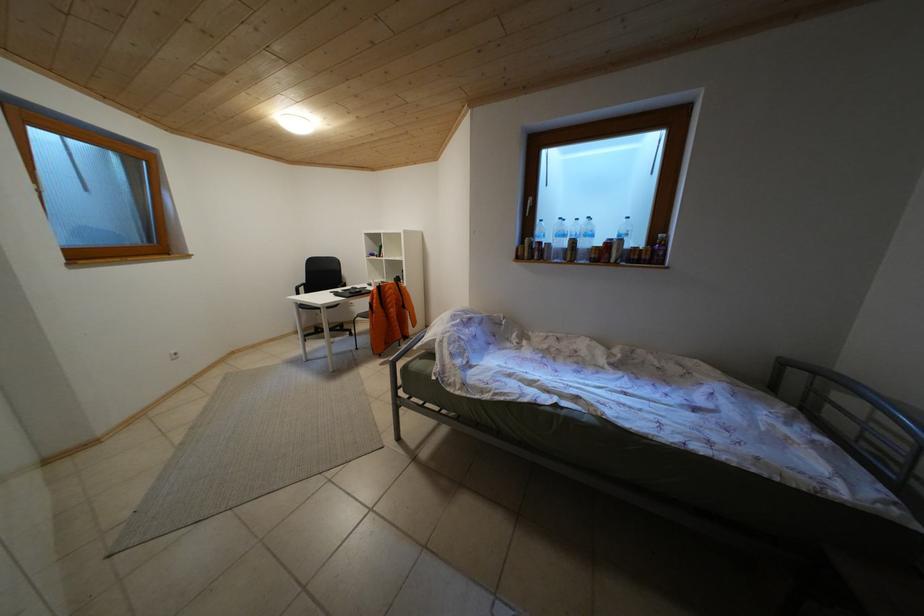
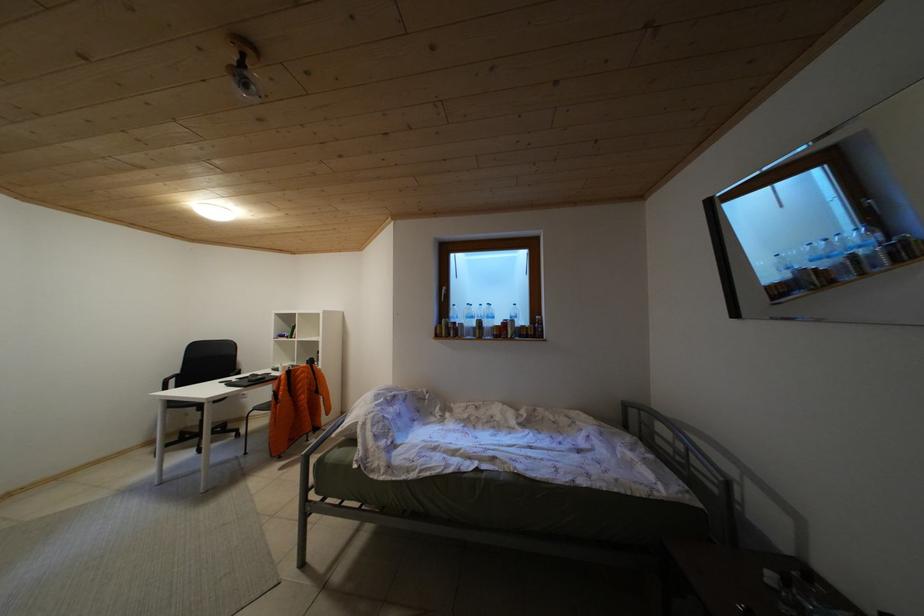
Question: Which direction would the cameraman need to move to produce the second image? Reply with the corresponding letter.

Choices:
 (A) Left
 (B) Right
 (C) Forward
 (D) Backward

Answer: (D)